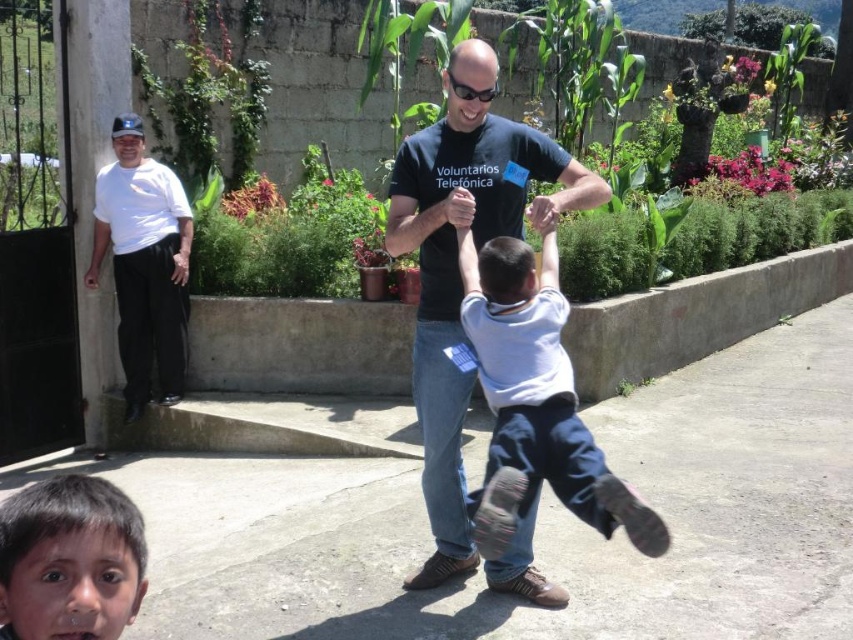
From the picture: Between white cotton shirt at center and dark brown hair at lower left, which one has less height?

dark brown hair at lower left

The image size is (853, 640). Identify the location of white cotton shirt at center. (535, 400).

I want to click on white cotton shirt at center, so click(x=535, y=400).

Does point (532, 177) lie in front of point (47, 579)?

No.

Is black cotton t-shirt at center wider than dark brown hair at lower left?

Correct, the width of black cotton t-shirt at center exceeds that of dark brown hair at lower left.

In the scene shown: Who is more distant from viewer, (402, 244) or (36, 492)?

The point (402, 244) is behind.

What are the coordinates of `black cotton t-shirt at center` in the screenshot? It's located at (460, 280).

Does black cotton t-shirt at center come in front of white cotton shirt at center?

No.

Can you confirm if black cotton t-shirt at center is positioned below white cotton shirt at center?

No.

Is point (459, 145) more distant than point (554, 417)?

Yes, point (459, 145) is farther from viewer.

Locate an element on the screen. This screenshot has width=853, height=640. black cotton t-shirt at center is located at coordinates (460, 280).